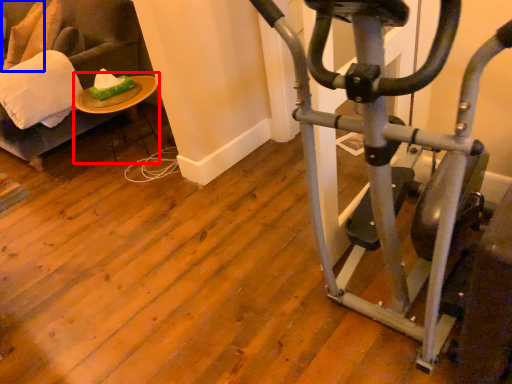
Question: Which point is further to the camera, table (highlighted by a red box) or pillow (highlighted by a blue box)?

Choices:
 (A) table
 (B) pillow

Answer: (B)